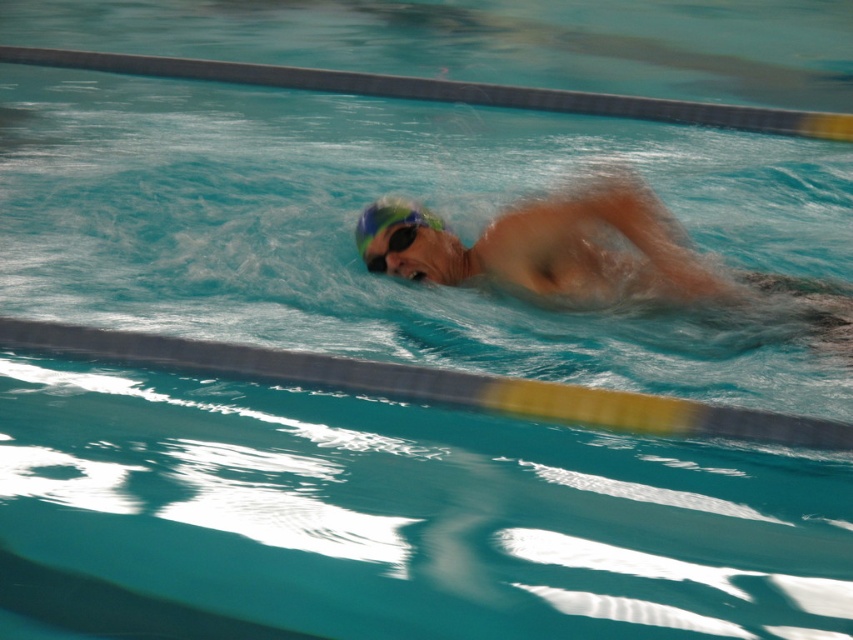
Is the position of matte green swim cap at center more distant than that of blue matte swim cap at center?

No, matte green swim cap at center is in front of blue matte swim cap at center.

Which is behind, point (747, 294) or point (425, 225)?

Positioned behind is point (425, 225).

You are a GUI agent. You are given a task and a screenshot of the screen. Output one action in this format:
    pyautogui.click(x=<x>, y=<y>)
    Task: Click on the matte green swim cap at center
    The image size is (853, 640).
    Given the screenshot: What is the action you would take?
    [583, 257]